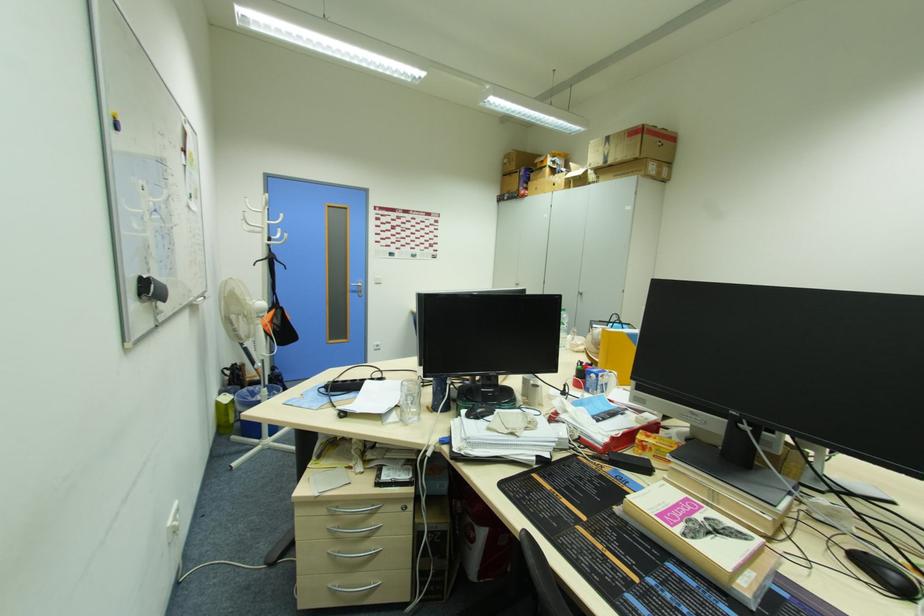
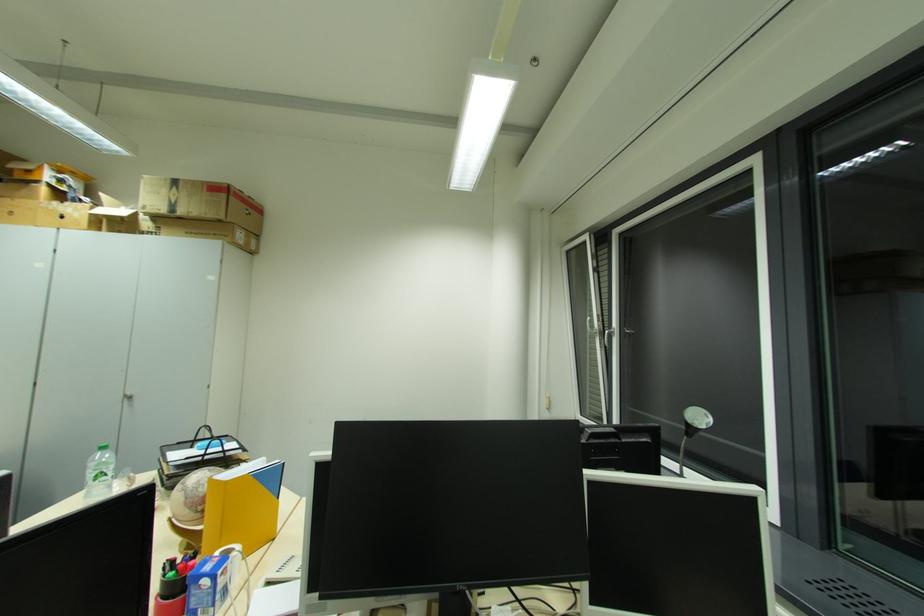
Find the pixel in the second image that matches the point at 603,379 in the first image.

(223, 582)